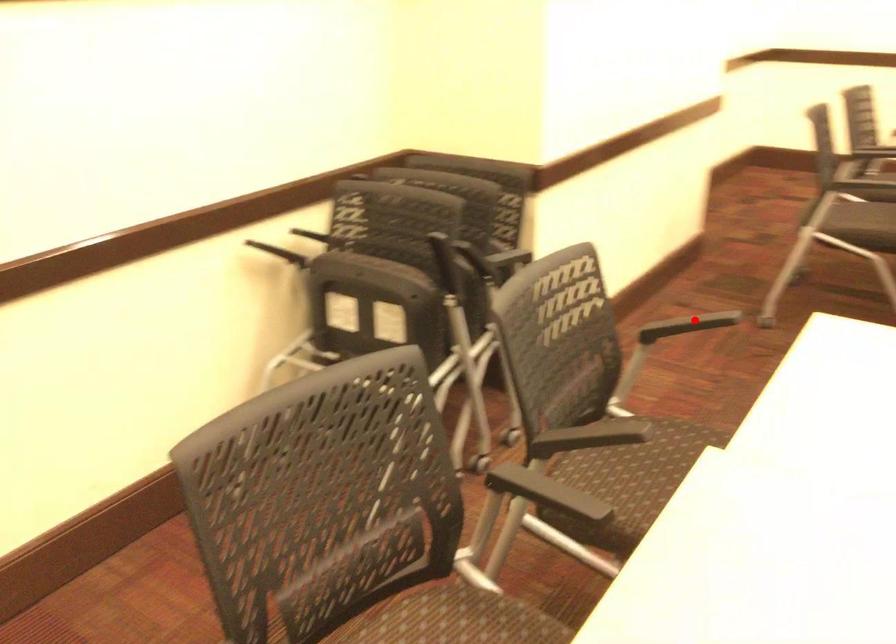
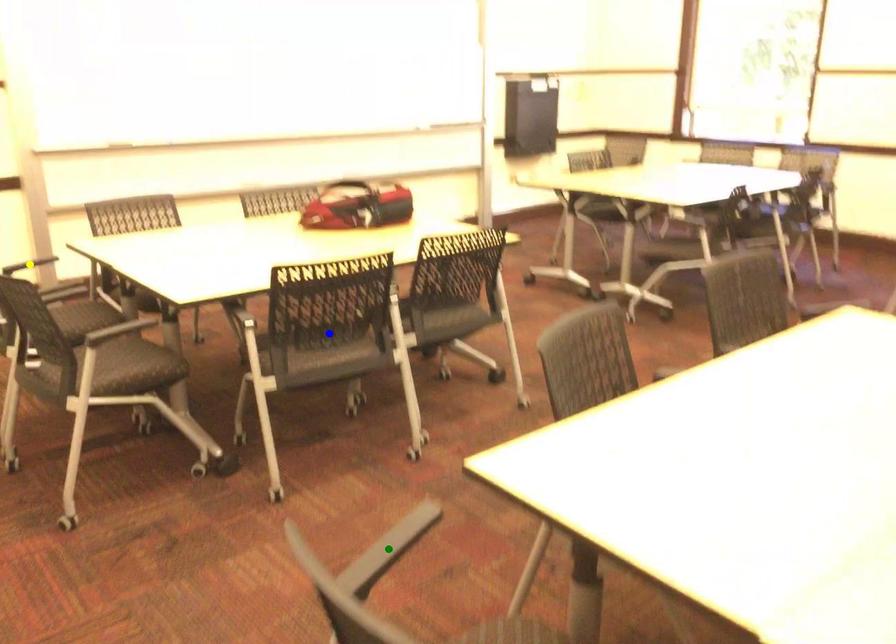
Question: I am providing you with two images of the same scene from different viewpoints. A red point is marked on the first image. You are given multiple points on the second image. Which point in image 2 is actually the same real-world point as the red point in image 1?

Choices:
 (A) green point
 (B) yellow point
 (C) blue point

Answer: (A)